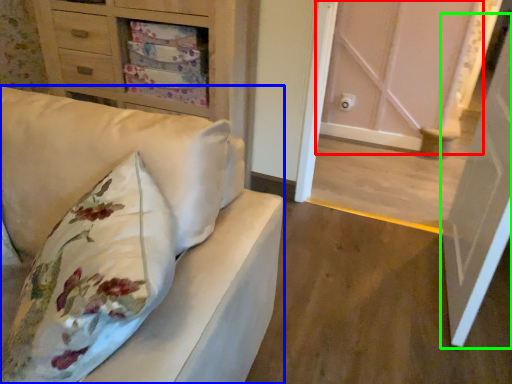
Question: Which object is positioned closest to door (highlighted by a red box)? Select from furniture (highlighted by a blue box) and door (highlighted by a green box).

Choices:
 (A) furniture
 (B) door

Answer: (B)